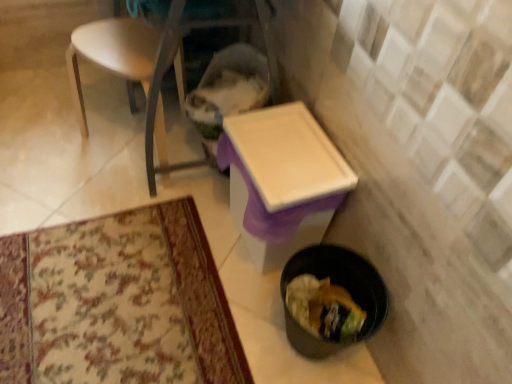
The height and width of the screenshot is (384, 512). I want to click on vacant region to the left of white plastic chair at upper left, so click(53, 131).